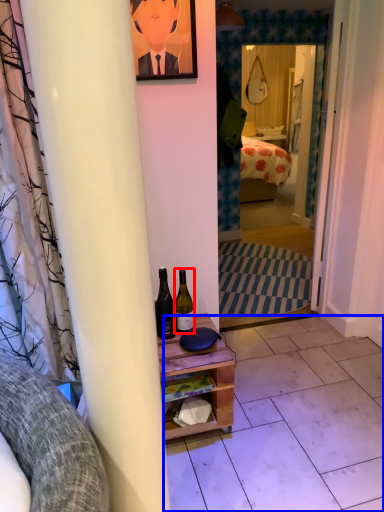
Question: Among these objects, which one is nearest to the camera, bottle (highlighted by a red box) or tile (highlighted by a blue box)?

Choices:
 (A) bottle
 (B) tile

Answer: (B)